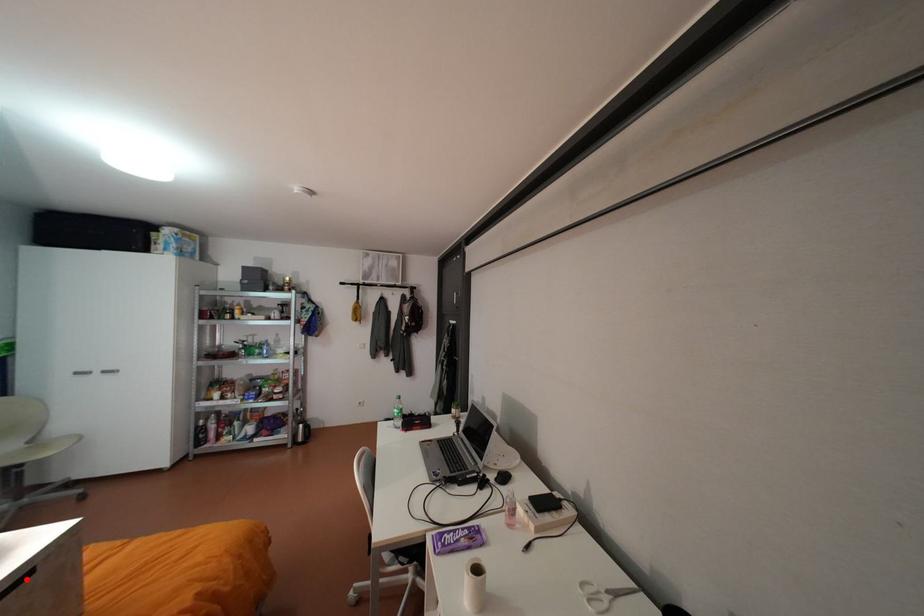
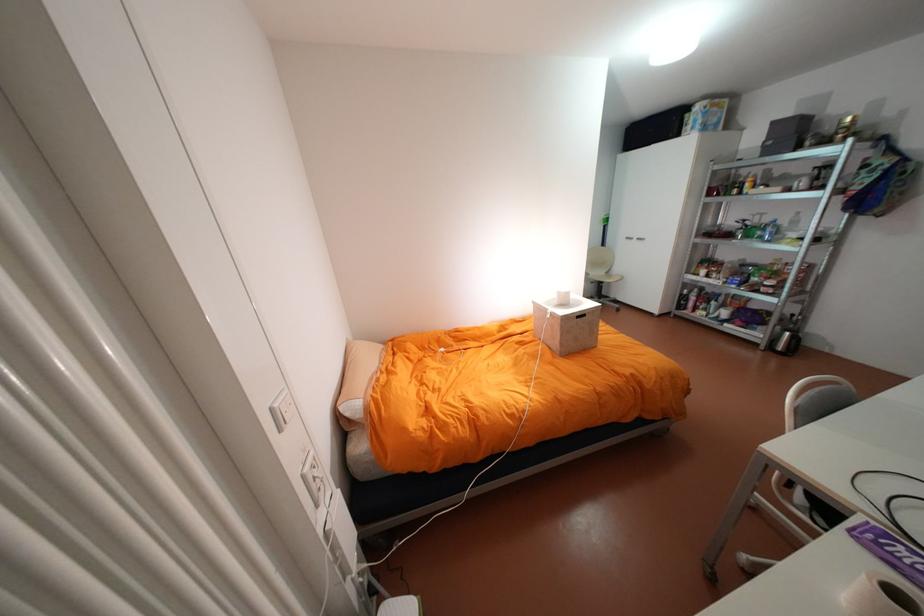
The point at the highlighted location is marked in the first image. Where is the corresponding point in the second image?

(590, 315)